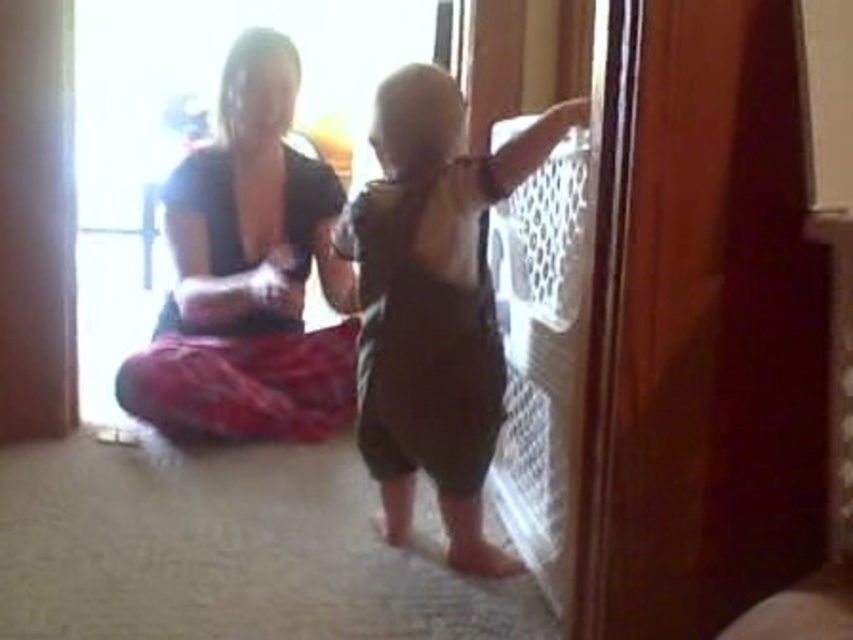
Does matte black shirt at center appear on the left side of dark brown cotton onesie at right?

Indeed, matte black shirt at center is positioned on the left side of dark brown cotton onesie at right.

Between point (264, 403) and point (424, 308), which one is positioned in front?

Point (424, 308) is more forward.

Find the location of a particular element. This screenshot has height=640, width=853. matte black shirt at center is located at coordinates (248, 275).